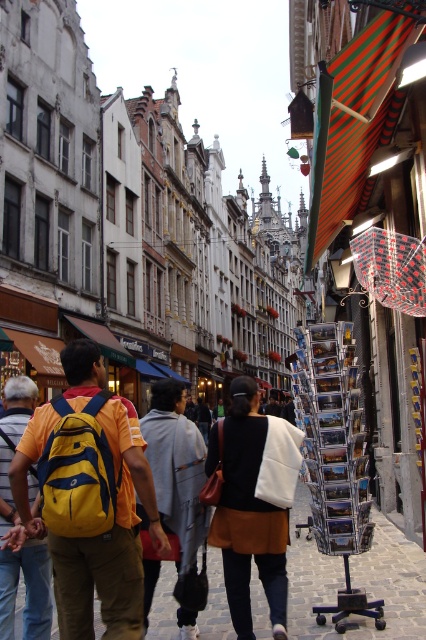
Question: Among these objects, which one is farthest from the camera?

Choices:
 (A) yellow backpack at left
 (B) brown cobblestone pavement at center
 (C) yellow fabric backpack at center

Answer: (B)

Question: Can you confirm if yellow fabric backpack at center is wider than brown cobblestone pavement at center?

Choices:
 (A) yes
 (B) no

Answer: (B)

Question: Does white cotton jacket at center appear under yellow backpack at left?

Choices:
 (A) yes
 (B) no

Answer: (A)

Question: Which of these objects is positioned closest to the yellow backpack at left?

Choices:
 (A) yellow fabric backpack at center
 (B) brown cobblestone pavement at center

Answer: (A)

Question: Is brown cobblestone pavement at center to the left of gray cotton hoodie at center from the viewer's perspective?

Choices:
 (A) no
 (B) yes

Answer: (A)

Question: Which of the following is the closest to the observer?

Choices:
 (A) brown cobblestone pavement at center
 (B) yellow fabric backpack at center

Answer: (B)